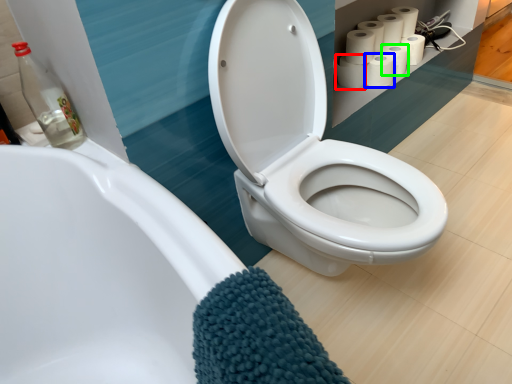
Question: Based on their relative distances, which object is farther from toilet paper (highlighted by a red box)? Choose from toilet paper (highlighted by a blue box) and toilet paper (highlighted by a green box).

Choices:
 (A) toilet paper
 (B) toilet paper

Answer: (B)